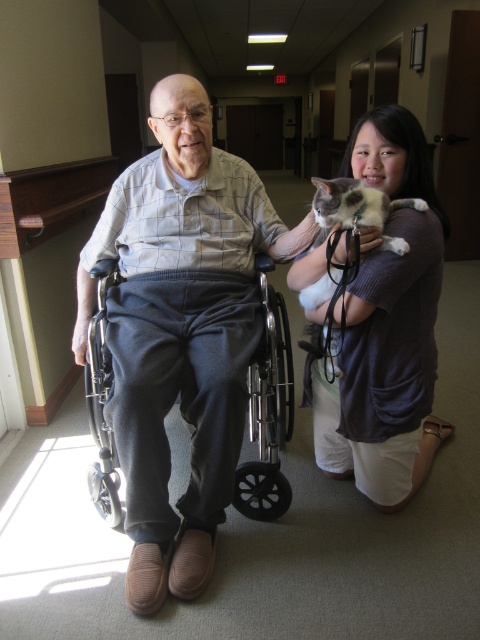
You are a nurse standing in the hallway and need to check the vital signs of the elderly man in the wheelchair. The medical kit is on a cart 2 meters away from you. Can you reach the gray corduroy pants at center without moving the wheelchair?

The gray corduroy pants at center are 1.37 meters away from the camera, so yes, you can reach them without moving the wheelchair since the distance is less than 2 meters.

You are standing in the hallway and want to take a photo of the elderly man in the wheelchair. The camera you are using has a zoom lens that can focus on specific points. If you focus on point 1 at coordinate point (278, 451) and point 2 at coordinate point (317, 211), which point will appear closer to you in the photo?

Point 1 at coordinate point (278, 451) will appear closer to you in the photo because it is further to the camera than point 2 at coordinate point (317, 211).

You are a caregiver in a nursing home. You need to move the metallic gray wheelchair at center so that it is to the right of the soft fur cat at right. Is this possible without moving the cat?

The metallic gray wheelchair at center is currently to the left of the soft fur cat at right. To move the wheelchair to the right of the cat, you would need to position it on the opposite side. Since the cat is at the right, moving the wheelchair further right might require space availability. However, based on the provided information, there is no mention of obstacles or space constraints preventing this. Therefore, it is possible to move the metallic gray wheelchair at center to the right of the soft fur